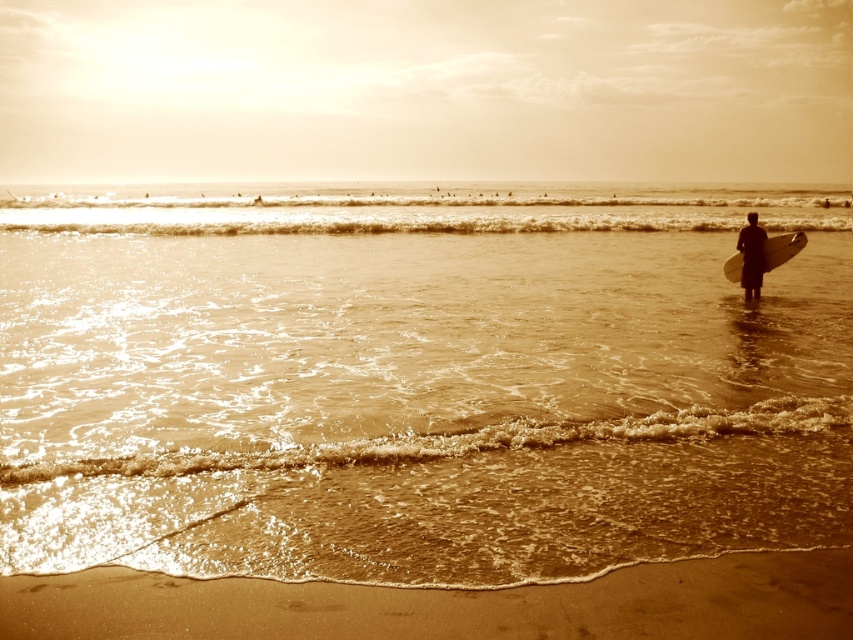
You are standing on the beach and see the brown water at center and the white matte surfboard at right. Which object is positioned more to the right side of the scene?

The white matte surfboard at right is positioned more to the right side of the scene than the brown water at center.